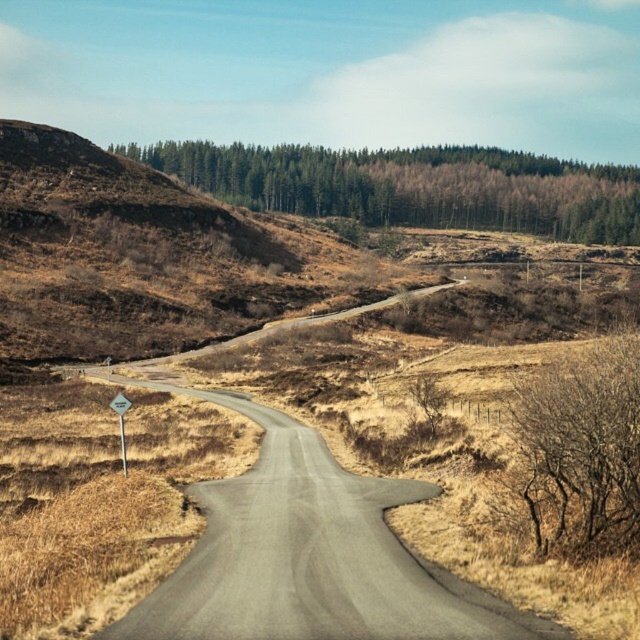
You are standing at the point labeled as point (307, 554). Which direction should you walk to reach the gray asphalt road at center?

The gray asphalt road at center is represented by point (307, 554), so you are already at the gray asphalt road at center.

You are driving along the winding road and notice the green leafy trees at upper center and the white plastic diamond at left. Which object is positioned to the right of the other?

The green leafy trees at upper center are to the right of the white plastic diamond at left.

You are driving along the winding road in the image and see the green leafy trees at upper center and the white plastic diamond at left. Which object will appear closer to you as you continue driving forward?

The green leafy trees at upper center will appear closer to you because they are positioned further to the viewer than the white plastic diamond at left, meaning they are nearer in your line of sight as you drive forward.